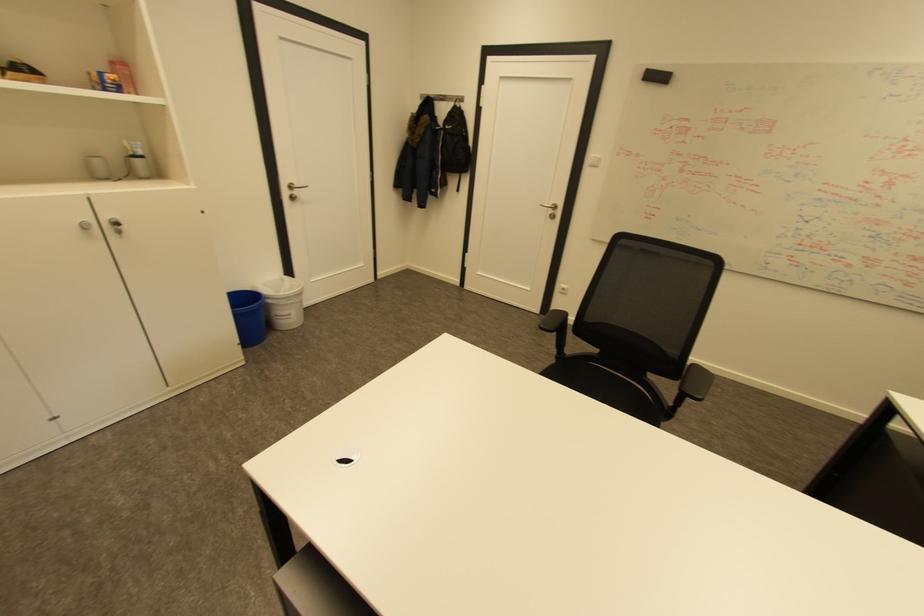
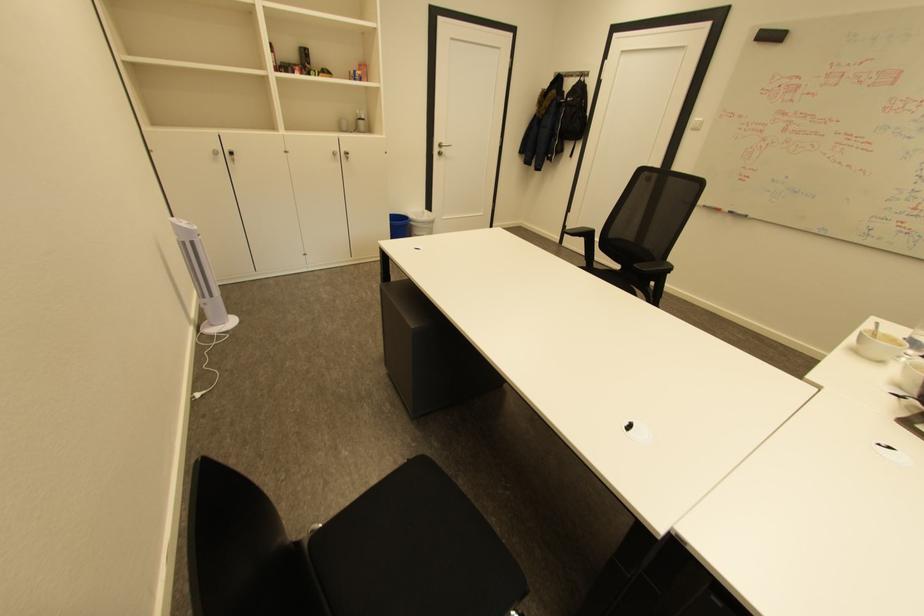
Find the pixel in the second image that matches [298,302] in the first image.

(432, 227)